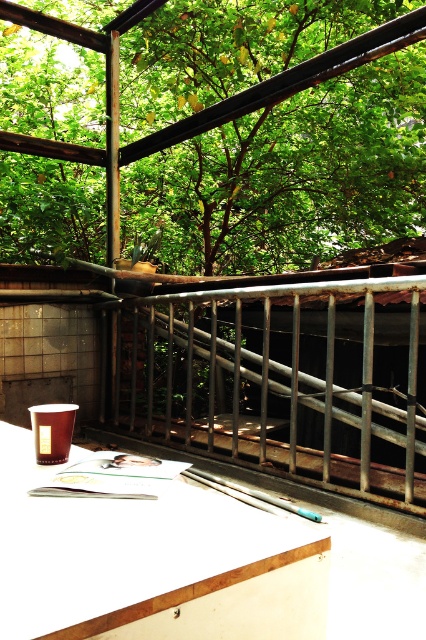
You are standing on the balcony and want to look at the green leafy tree at upper center. Which direction should you turn your head to see it from the rusty metal railing at center?

The green leafy tree at upper center is to the left of the rusty metal railing at center, so you should turn your head to the left to see it from the rusty metal railing at center.

You are a painter standing on the balcony, and you want to paint both the green leafy tree at upper center and the metallic silver skateboard at center. Which object will require a larger canvas area to capture its full width?

The green leafy tree at upper center requires a larger canvas area because its width surpasses that of the metallic silver skateboard at center.